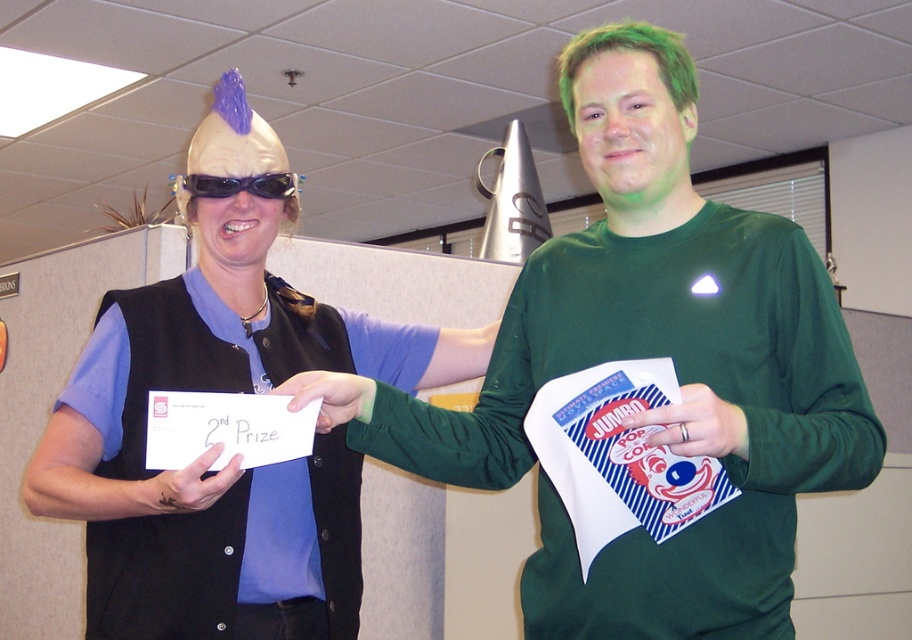
Between green matte t-shirt at center and black plastic goggles at upper center, which one is positioned lower?

green matte t-shirt at center is lower down.

Does green matte t-shirt at center come in front of black plastic goggles at upper center?

Yes, it is.

You are a GUI agent. You are given a task and a screenshot of the screen. Output one action in this format:
    pyautogui.click(x=<x>, y=<y>)
    Task: Click on the green matte t-shirt at center
    Image resolution: width=912 pixels, height=640 pixels.
    Given the screenshot: What is the action you would take?
    pyautogui.click(x=680, y=385)

Find the location of a particular element. The height and width of the screenshot is (640, 912). green matte t-shirt at center is located at coordinates click(680, 385).

Can you confirm if matte black vest at center is positioned to the left of black plastic goggles at upper center?

No, matte black vest at center is not to the left of black plastic goggles at upper center.

Does matte black vest at center have a lesser width compared to black plastic goggles at upper center?

No, matte black vest at center is not thinner than black plastic goggles at upper center.

Between point (361, 460) and point (192, 177), which one is positioned behind?

The point (361, 460) is behind.

Identify the location of matte black vest at center. The width and height of the screenshot is (912, 640). (223, 554).

Which is above, green matte t-shirt at center or matte black vest at center?

green matte t-shirt at center is above.

What do you see at coordinates (680, 385) in the screenshot?
I see `green matte t-shirt at center` at bounding box center [680, 385].

Locate an element on the screen. green matte t-shirt at center is located at coordinates (680, 385).